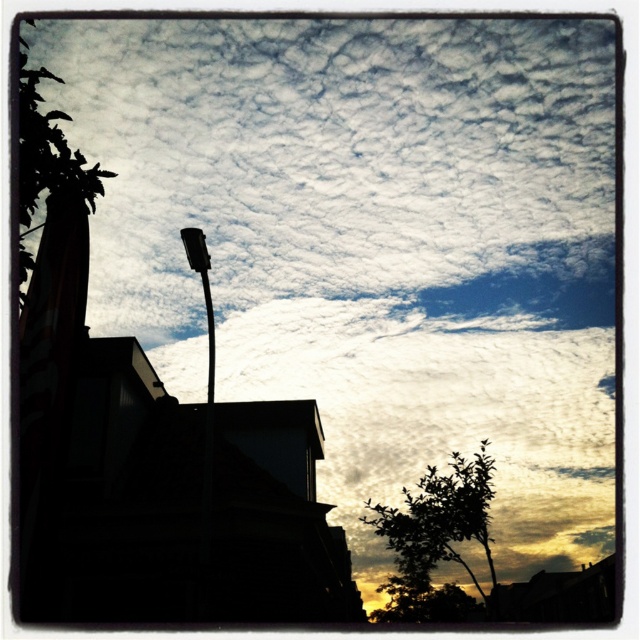
From the picture: You are a city planner assessing the placement of new streetlights. You notice the silhouette leafy tree at lower right and the black glossy streetlight at upper center in the image. Based on their distance, would the current spacing between them meet the city regulation requiring a minimum of 20 meters between trees and streetlights?

The silhouette leafy tree at lower right and the black glossy streetlight at upper center are 21.85 meters apart, which exceeds the required minimum of 20 meters. Therefore, the current spacing meets the city regulation.

You are an observer looking at the image. You see a silhouette leafy tree at lower right and a green leafy tree at upper left. Which tree is positioned higher in the image?

The green leafy tree at upper left is positioned higher in the image than the silhouette leafy tree at lower right.

You are an architect analyzing the spatial arrangement of the scene. Which tree, the silhouette leafy tree at lower right or the green leafy tree at upper left, is positioned closer to the observer?

The silhouette leafy tree at lower right is closer to the observer because the green leafy tree at upper left is positioned behind it.